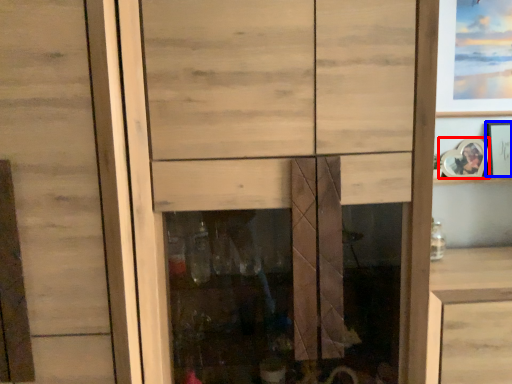
Question: Which of the following is the closest to the observer, picture frame (highlighted by a red box) or picture frame (highlighted by a blue box)?

Choices:
 (A) picture frame
 (B) picture frame

Answer: (A)